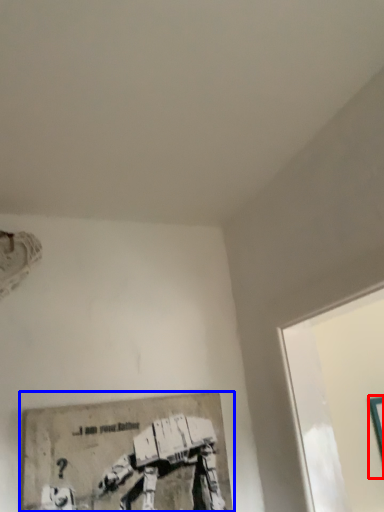
Question: Among these objects, which one is farthest to the camera, picture frame (highlighted by a red box) or picture frame (highlighted by a blue box)?

Choices:
 (A) picture frame
 (B) picture frame

Answer: (A)